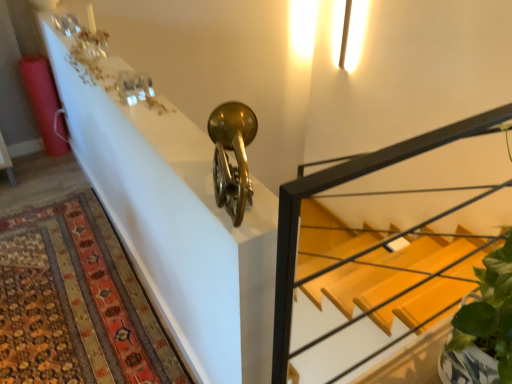
Question: Can we say metallic gold trumpet at upper center lies outside wooden stairs at center?

Choices:
 (A) yes
 (B) no

Answer: (A)

Question: Considering the relative sizes of metallic gold trumpet at upper center and wooden stairs at center in the image provided, is metallic gold trumpet at upper center taller than wooden stairs at center?

Choices:
 (A) yes
 (B) no

Answer: (B)

Question: Considering the relative positions of metallic gold trumpet at upper center and wooden stairs at center in the image provided, is metallic gold trumpet at upper center behind wooden stairs at center?

Choices:
 (A) no
 (B) yes

Answer: (B)

Question: Are metallic gold trumpet at upper center and wooden stairs at center beside each other?

Choices:
 (A) no
 (B) yes

Answer: (A)

Question: Is metallic gold trumpet at upper center to the left of wooden stairs at center from the viewer's perspective?

Choices:
 (A) no
 (B) yes

Answer: (B)

Question: From a real-world perspective, is wooden stairs at center physically located above or below carpeted rug at lower left?

Choices:
 (A) below
 (B) above

Answer: (B)

Question: Is wooden stairs at center taller or shorter than carpeted rug at lower left?

Choices:
 (A) short
 (B) tall

Answer: (B)

Question: Is wooden stairs at center bigger or smaller than carpeted rug at lower left?

Choices:
 (A) small
 (B) big

Answer: (B)

Question: Is point (453, 291) closer or farther from the camera than point (18, 370)?

Choices:
 (A) closer
 (B) farther

Answer: (B)

Question: Looking at their shapes, would you say metallic gold trumpet at upper center is wider or thinner than carpeted rug at lower left?

Choices:
 (A) wide
 (B) thin

Answer: (B)

Question: Is metallic gold trumpet at upper center in front of or behind carpeted rug at lower left in the image?

Choices:
 (A) front
 (B) behind

Answer: (A)

Question: Considering the positions of metallic gold trumpet at upper center and carpeted rug at lower left in the image, is metallic gold trumpet at upper center taller or shorter than carpeted rug at lower left?

Choices:
 (A) tall
 (B) short

Answer: (B)

Question: Choose the correct answer: Is metallic gold trumpet at upper center inside carpeted rug at lower left or outside it?

Choices:
 (A) inside
 (B) outside

Answer: (B)

Question: Visually, is wooden stairs at center positioned to the left or to the right of metallic gold trumpet at upper center?

Choices:
 (A) right
 (B) left

Answer: (A)

Question: Considering the positions of wooden stairs at center and metallic gold trumpet at upper center in the image, is wooden stairs at center wider or thinner than metallic gold trumpet at upper center?

Choices:
 (A) wide
 (B) thin

Answer: (B)